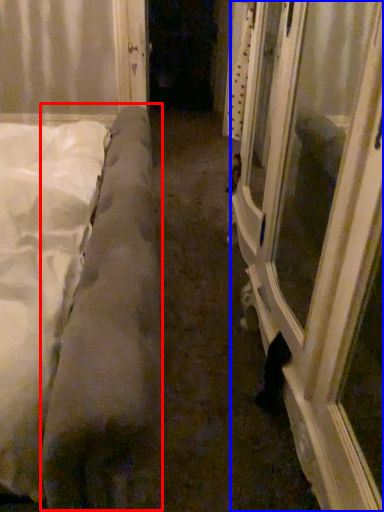
Question: Which of the following is the closest to the observer, mattress (highlighted by a red box) or window frame (highlighted by a blue box)?

Choices:
 (A) mattress
 (B) window frame

Answer: (A)